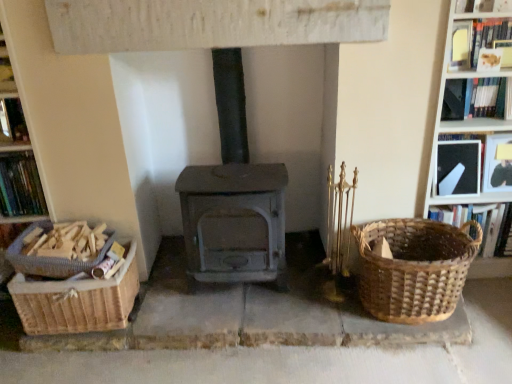
Question: Is woven brown basket at lower left inside the boundaries of black paper at upper right, the 3th book when ordered from right to left, or outside?

Choices:
 (A) inside
 (B) outside

Answer: (B)

Question: Considering the positions of woven brown basket at lower left and black paper at upper right, the 3th book when ordered from right to left, in the image, is woven brown basket at lower left bigger or smaller than black paper at upper right, the 3th book when ordered from right to left,?

Choices:
 (A) big
 (B) small

Answer: (A)

Question: Considering the real-world distances, which object is farthest from the hardcover books at left, placed as the second book when sorted from left to right?

Choices:
 (A) matte black book at upper right, which appears as the seventh book when viewed from the left
 (B) hardcover book at upper left, which is the 7th book in right-to-left order
 (C) hardcover book at upper right, placed as the third book when sorted from left to right
 (D) woven brown basket at lower left
 (E) woven basket at right, which is the second book from right to left

Answer: (A)

Question: Which object is the closest to the woven basket at right, which is the second book from right to left?

Choices:
 (A) hardcover book at upper right, which is counted as the fourth book, starting from the left
 (B) gray matte wood burning stove at center
 (C) woven brown basket at lower left
 (D) hardcover book at upper right, placed as the third book when sorted from left to right
 (E) hardcover books at left, placed as the second book when sorted from left to right

Answer: (A)